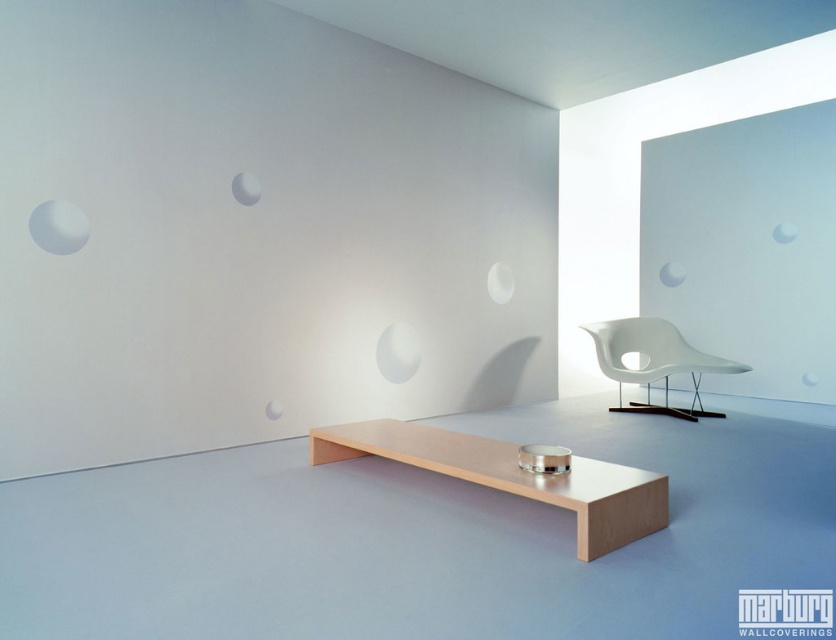
You are standing in the minimalist room and want to place a small sculpture exactly halfway between the point at coordinates (580, 534) and the point at (607, 344). Given the spatial relationship between these two points, will the sculpture be closer to the wall with the many circular cutouts or the wall with fewer cutouts?

The sculpture placed halfway between point (580, 534) and point (607, 344) will be closer to the wall with fewer cutouts because point (580, 534) is closer to the viewer than point (607, 344). This means the midpoint leans towards the farther point, which is near the right wall with fewer cutouts.